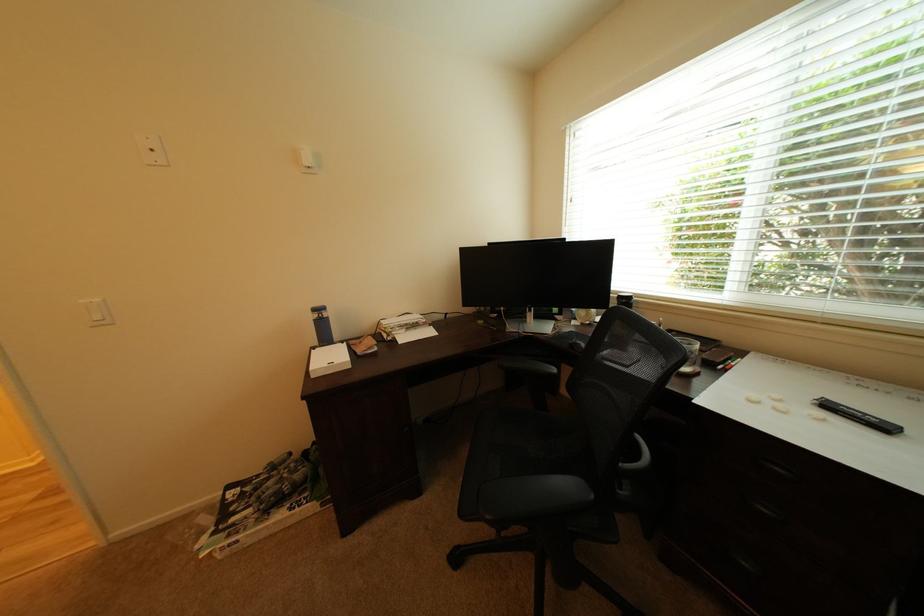
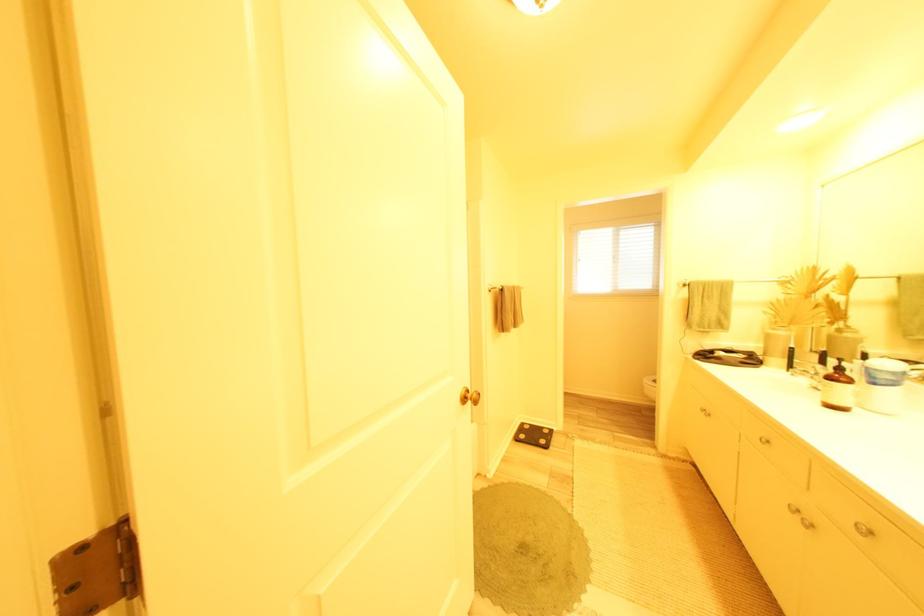
Question: I am providing you with two images of the same scene from different viewpoints. After the viewpoint changes to image2, which objects are now occluded?

Choices:
 (A) brown bottle pump
 (B) black handheld tool
 (C) gold door knob
 (D) black computer mouse

Answer: (D)